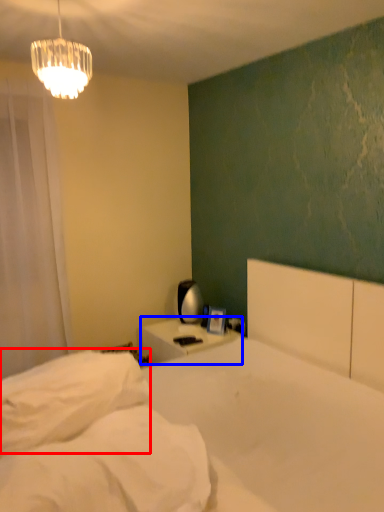
Question: Which object is further to the camera taking this photo, pillow (highlighted by a red box) or nightstand (highlighted by a blue box)?

Choices:
 (A) pillow
 (B) nightstand

Answer: (B)